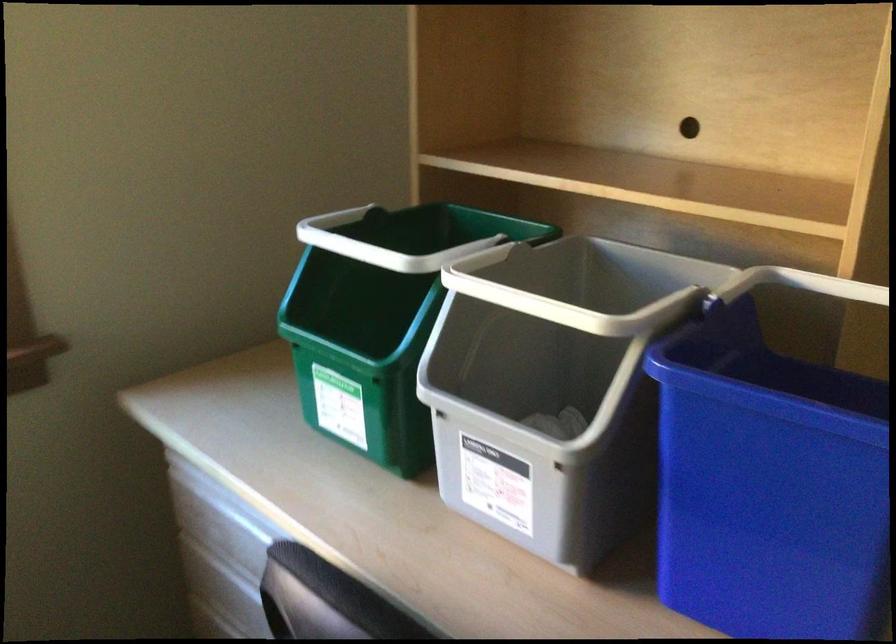
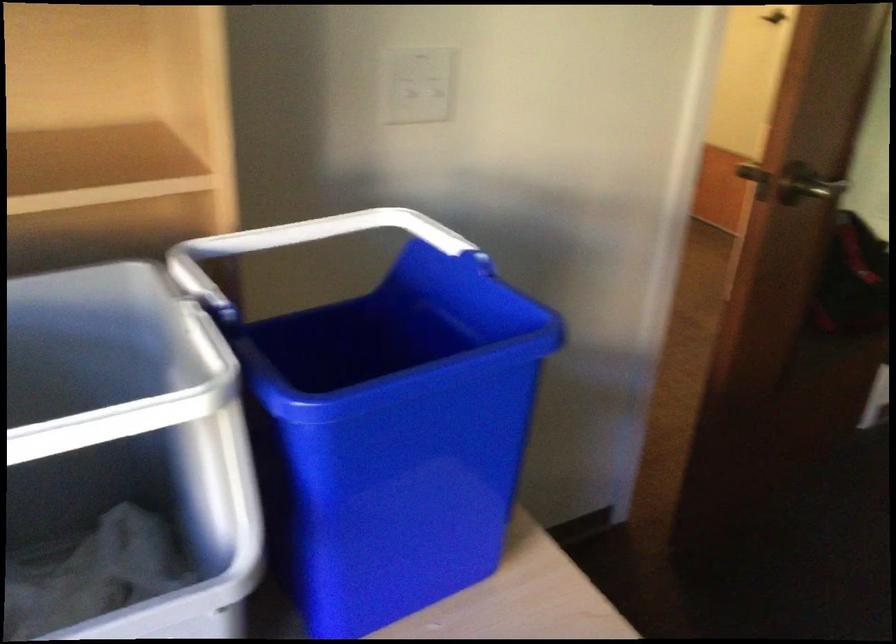
How did the camera likely rotate?

The camera's rotation is toward right-down.